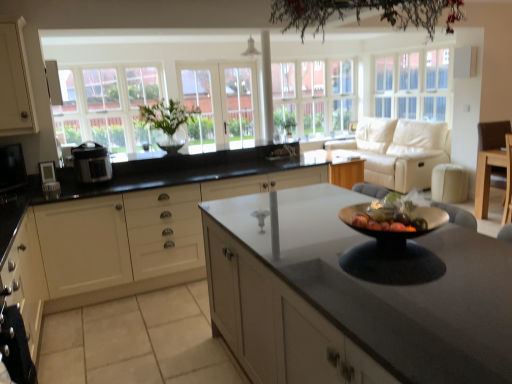
Question: Should I look upward or downward to see green leafy plant at center?

Choices:
 (A) up
 (B) down

Answer: (A)

Question: Is white matte cabinet at center, acting as the 1th cabinetry starting from the right, inside light brown wood chair at right?

Choices:
 (A) yes
 (B) no

Answer: (B)

Question: Is light brown wood chair at right facing towards white matte cabinet at center, acting as the 1th cabinetry starting from the right?

Choices:
 (A) no
 (B) yes

Answer: (A)

Question: Is light brown wood chair at right bigger than white matte cabinet at center, the 3th cabinetry from the left?

Choices:
 (A) no
 (B) yes

Answer: (A)

Question: Is the surface of light brown wood chair at right in direct contact with white matte cabinet at center, the 3th cabinetry from the left?

Choices:
 (A) no
 (B) yes

Answer: (A)

Question: From the image's perspective, is light brown wood chair at right on white matte cabinet at center, the 3th cabinetry from the left?

Choices:
 (A) yes
 (B) no

Answer: (A)

Question: Is light brown wood chair at right thinner than white matte cabinet at center, the 3th cabinetry from the left?

Choices:
 (A) no
 (B) yes

Answer: (B)

Question: Is clear glass door at center, which is the 1th glass door from right to left, to the left of beige leather couch at upper right from the viewer's perspective?

Choices:
 (A) no
 (B) yes

Answer: (B)

Question: Considering the relative sizes of clear glass door at center, which is the 1th glass door from right to left, and beige leather couch at upper right in the image provided, is clear glass door at center, which is the 1th glass door from right to left, taller than beige leather couch at upper right?

Choices:
 (A) no
 (B) yes

Answer: (B)

Question: Can beige leather couch at upper right be found inside clear glass door at center, which is counted as the second glass door, starting from the left?

Choices:
 (A) yes
 (B) no

Answer: (B)

Question: Is clear glass door at center, which is the 1th glass door from right to left, placed right next to beige leather couch at upper right?

Choices:
 (A) no
 (B) yes

Answer: (A)

Question: Is clear glass door at center, which is counted as the second glass door, starting from the left, positioned before beige leather couch at upper right?

Choices:
 (A) no
 (B) yes

Answer: (A)

Question: From a real-world perspective, does clear glass door at center, which is counted as the second glass door, starting from the left, sit lower than beige leather couch at upper right?

Choices:
 (A) yes
 (B) no

Answer: (B)

Question: Is white glass window at left, positioned as the 1th window in left-to-right order, oriented away from matte black microwave at left, the 1th appliance when ordered from left to right?

Choices:
 (A) no
 (B) yes

Answer: (A)